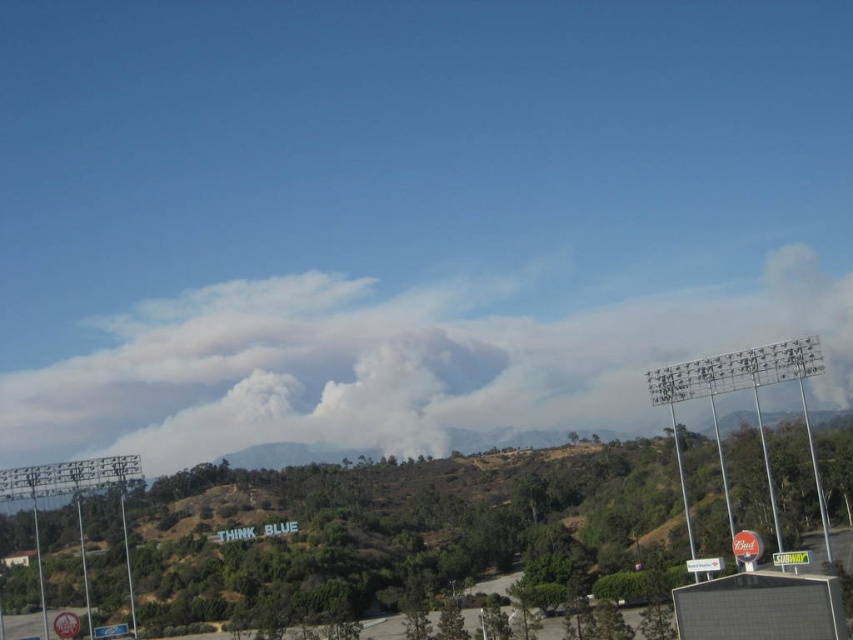
You are a firefighter assessing the scene from a distance. You see the white smoke cloud at center and the green grassy hillside at center. Which object is closer to you?

The white smoke cloud at center is closer to you than the green grassy hillside at center because it is further to the viewer.

You are standing at the base of the stadium lights in the foreground and want to reach the white smoke cloud at center. Which direction should you head towards?

The white smoke cloud at center is located at point (390,365), so you should head towards the center of the image to reach it.